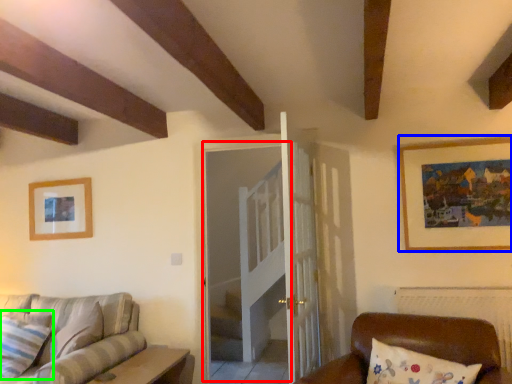
Question: Which object is the closest to the glass door (highlighted by a red box)? Choose among these: picture frame (highlighted by a blue box) or pillow (highlighted by a green box).

Choices:
 (A) picture frame
 (B) pillow

Answer: (A)